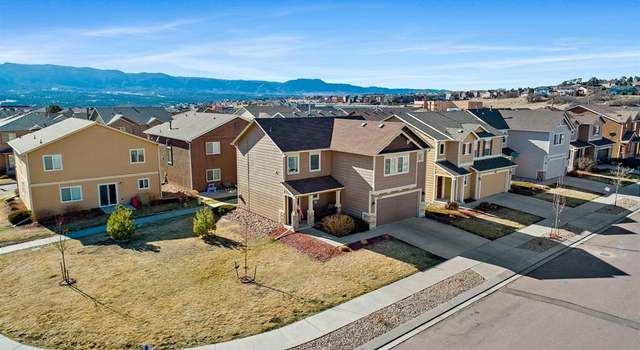
Identify the location of doors. The width and height of the screenshot is (640, 350). (108, 193), (290, 204), (436, 185), (575, 156).